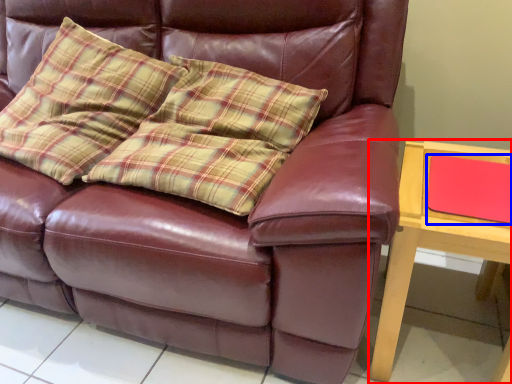
Question: Which of the following is the farthest to the observer, table (highlighted by a red box) or pad (highlighted by a blue box)?

Choices:
 (A) table
 (B) pad

Answer: (B)